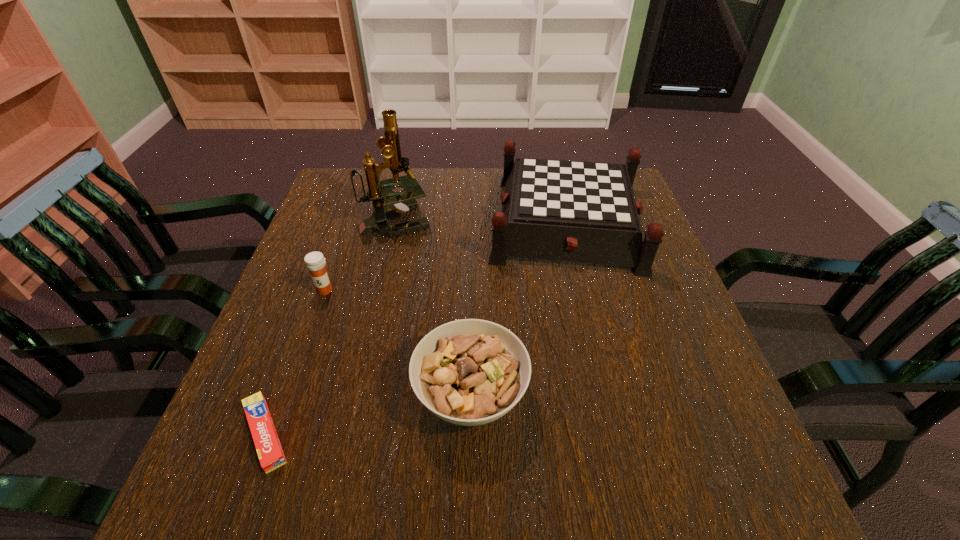
At what (x,y) coordinates should I click in order to perform the action: click on free point that satisfies the following two spatial constraints: 1. on the back side of the toothpaste; 2. on the left side of the fourth shortest object. Please return your answer as a coordinate pair (x, y). Looking at the image, I should click on (344, 222).

Where is `free space that satisfies the following two spatial constraints: 1. at the eyepiece of the checkerboard; 2. on the right side of the microscope`? This screenshot has height=540, width=960. free space that satisfies the following two spatial constraints: 1. at the eyepiece of the checkerboard; 2. on the right side of the microscope is located at coordinates (395, 222).